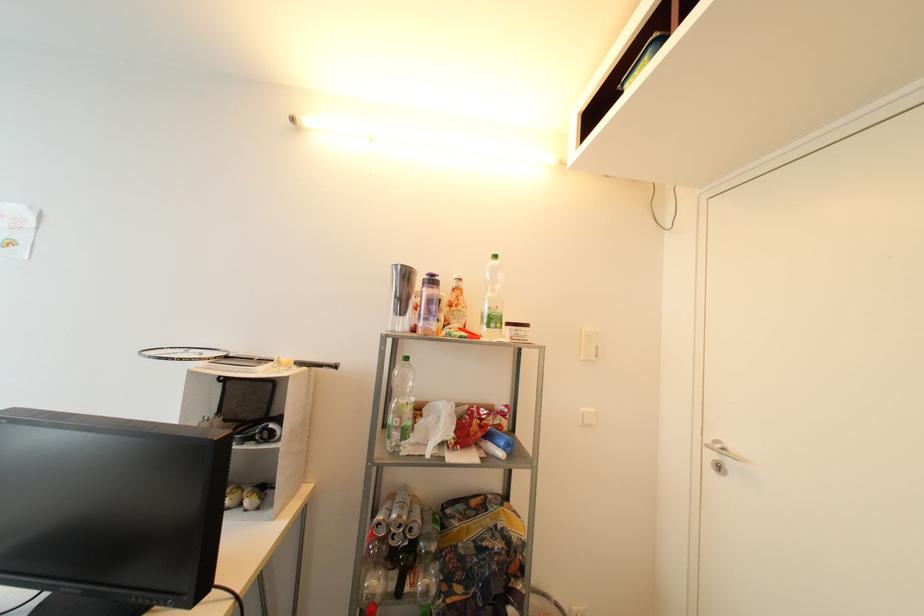
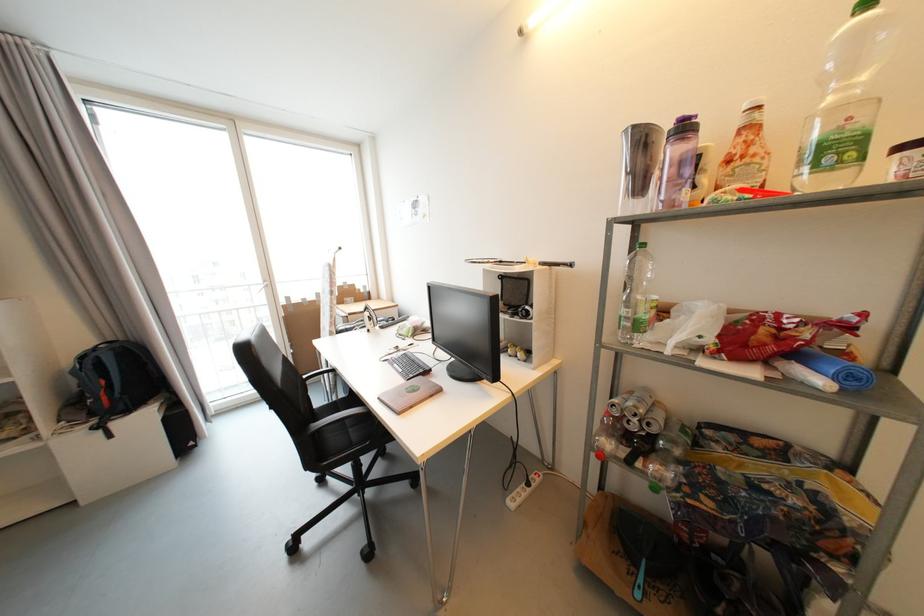
Where in the second image is the point corresponding to the point at 438,283 from the first image?

(689, 130)